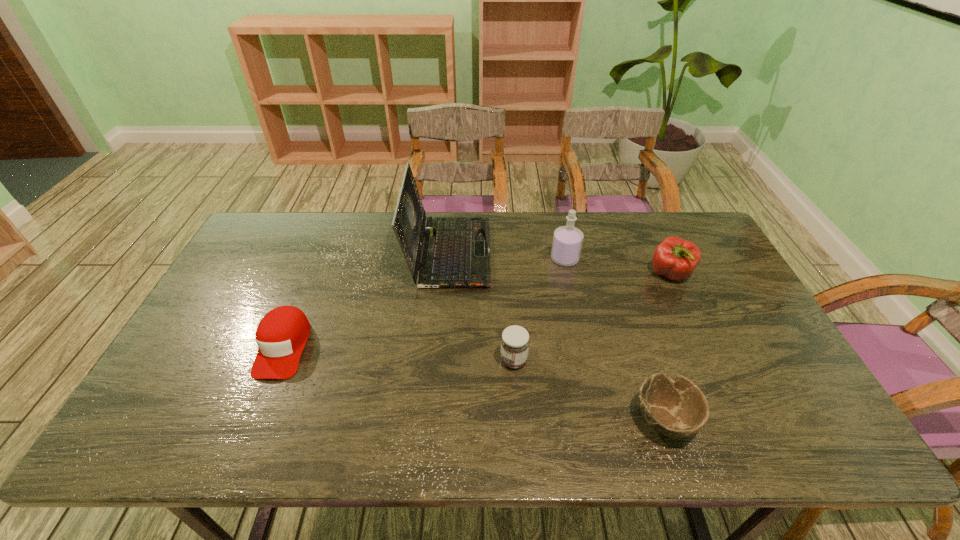
Find the location of a particular element. object at the near edge is located at coordinates (677, 408).

Identify the location of object situated at the right edge. (675, 258).

At what (x,y) coordinates should I click in order to perform the action: click on free space at the far edge. Please return your answer as a coordinate pair (x, y). Looking at the image, I should click on (521, 240).

You are a GUI agent. You are given a task and a screenshot of the screen. Output one action in this format:
    pyautogui.click(x=<x>, y=<y>)
    Task: Click on the vacant region at the right edge of the desktop
    The width and height of the screenshot is (960, 540).
    Given the screenshot: What is the action you would take?
    pyautogui.click(x=712, y=310)

The width and height of the screenshot is (960, 540). In order to click on free space at the far left corner of the desktop in this screenshot , I will do `click(269, 237)`.

Identify the location of vacant space at the far right corner of the desktop. The width and height of the screenshot is (960, 540). (701, 242).

Identify the location of free space that is in between the fourth object from right to left and the perfume. (540, 309).

This screenshot has width=960, height=540. Find the location of `free point between the jam and the baseball cap`. free point between the jam and the baseball cap is located at coordinates (398, 354).

This screenshot has height=540, width=960. I want to click on free spot between the fifth shortest object and the fourth object from right to left, so click(x=540, y=309).

Find the location of a particular element. The height and width of the screenshot is (540, 960). free point between the baseball cap and the fourth object from left to right is located at coordinates (424, 303).